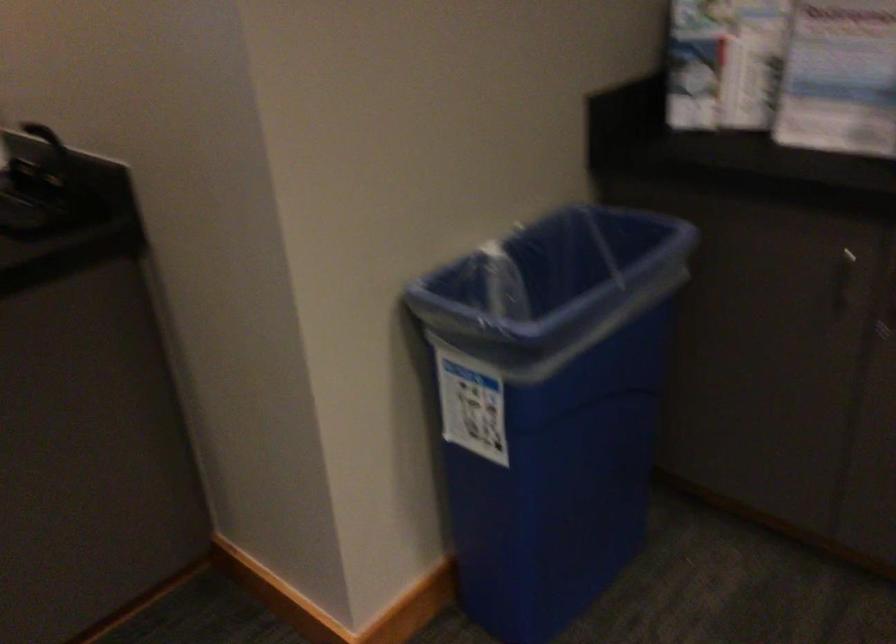
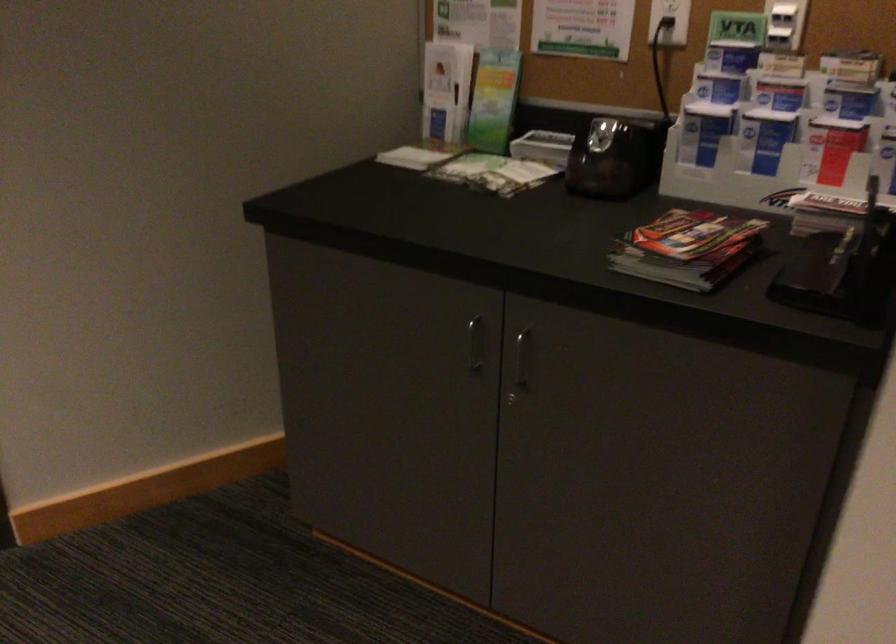
First-person continuous shooting, in which direction is the camera rotating?

The camera's rotation is toward left-down.